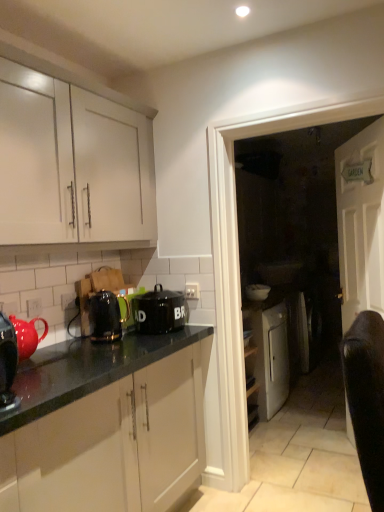
Where is `free region under white glossy door at center (from a real-world perspective)`? Image resolution: width=384 pixels, height=512 pixels. free region under white glossy door at center (from a real-world perspective) is located at coordinates (299, 500).